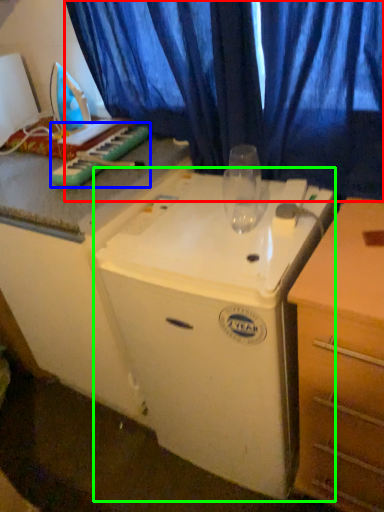
Question: Which is farther away from curtain (highlighted by a red box)? musical keyboard (highlighted by a blue box) or appliance (highlighted by a green box)?

Choices:
 (A) musical keyboard
 (B) appliance

Answer: (B)